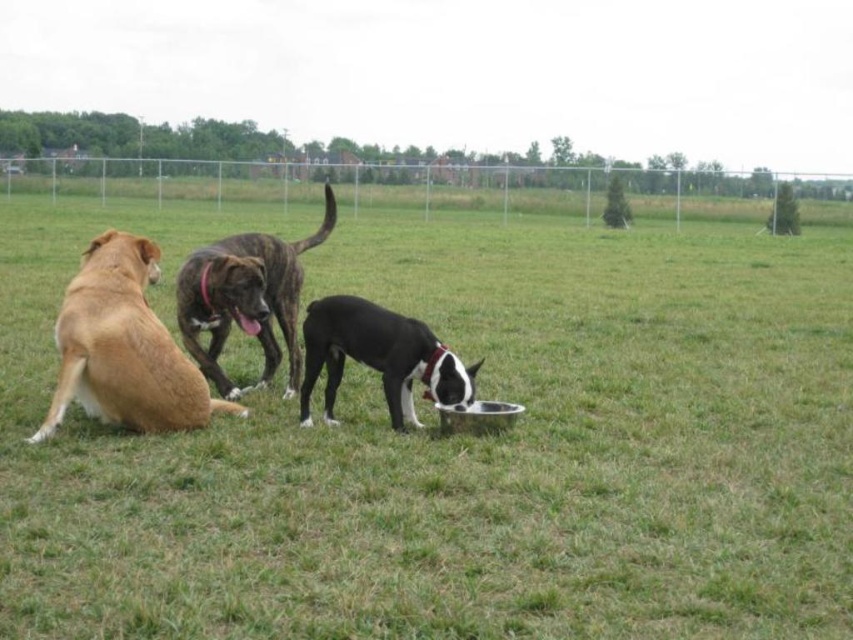
Which is in front, point (474, 612) or point (229, 412)?

Point (474, 612)

In the scene shown: Does green grass at center appear on the right side of golden fur dog at left?

Yes, green grass at center is to the right of golden fur dog at left.

The height and width of the screenshot is (640, 853). I want to click on green grass at center, so click(x=457, y=444).

Locate an element on the screen. The image size is (853, 640). green grass at center is located at coordinates (457, 444).

Is golden fur dog at left closer to the viewer compared to brindle fur dog at center?

Yes.

Who is shorter, golden fur dog at left or brindle fur dog at center?

With less height is golden fur dog at left.

Where is `golden fur dog at left`? golden fur dog at left is located at coordinates (123, 348).

Is brindle fur dog at center behind black matte dog at center?

Yes, brindle fur dog at center is behind black matte dog at center.

Does brindle fur dog at center have a greater width compared to black matte dog at center?

In fact, brindle fur dog at center might be narrower than black matte dog at center.

Is point (231, 266) closer to camera compared to point (335, 388)?

No, it is behind (335, 388).

At what (x,y) coordinates should I click in order to perform the action: click on brindle fur dog at center. Please return your answer as a coordinate pair (x, y). Looking at the image, I should click on (245, 298).